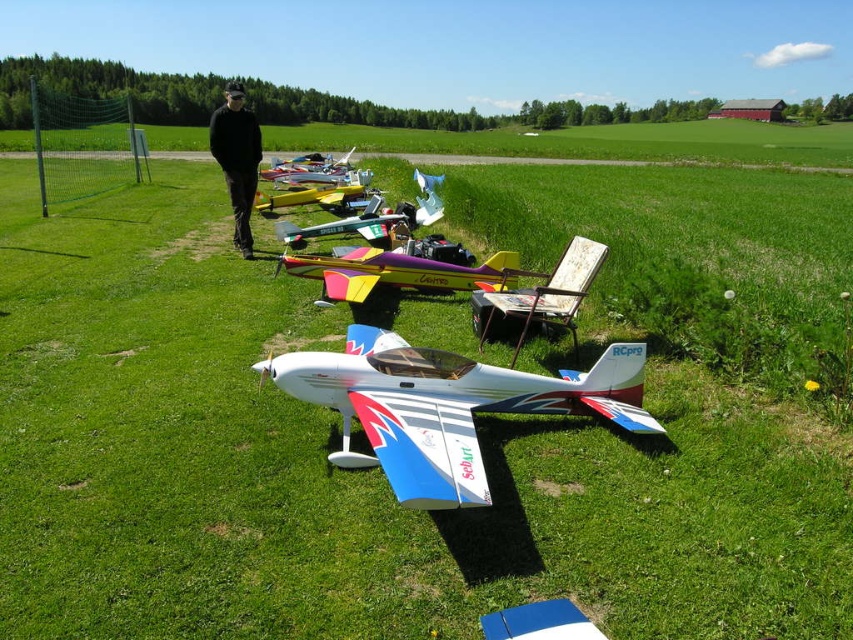
Question: Considering the real-world distances, which object is closest to the metallic silver airplane at center?

Choices:
 (A) shiny yellow and purple airplane at center
 (B) yellow matte airplane at center

Answer: (B)

Question: Is the position of black matte clothing at center more distant than that of shiny metallic airplane at center?

Choices:
 (A) yes
 (B) no

Answer: (B)

Question: Is black matte clothing at center above yellow matte airplane at center?

Choices:
 (A) no
 (B) yes

Answer: (B)

Question: Which object is closer to the camera taking this photo?

Choices:
 (A) shiny metallic airplane at center
 (B) shiny yellow and purple airplane at center

Answer: (B)

Question: Does black matte clothing at center have a greater width compared to shiny metallic airplane at center?

Choices:
 (A) yes
 (B) no

Answer: (B)

Question: Which of the following is the closest to the observer?

Choices:
 (A) (422, 269)
 (B) (357, 184)

Answer: (A)